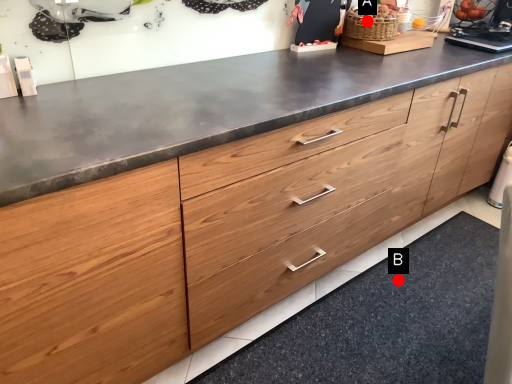
Question: Two points are circled on the image, labeled by A and B beside each circle. Which point is closer to the camera taking this photo?

Choices:
 (A) A is closer
 (B) B is closer

Answer: (A)